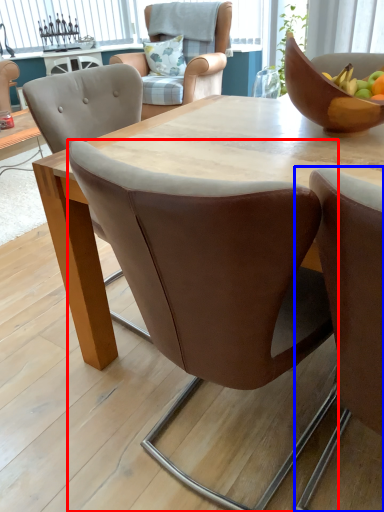
Question: Which object appears farthest to the camera in this image, chair (highlighted by a red box) or chair (highlighted by a blue box)?

Choices:
 (A) chair
 (B) chair

Answer: (A)